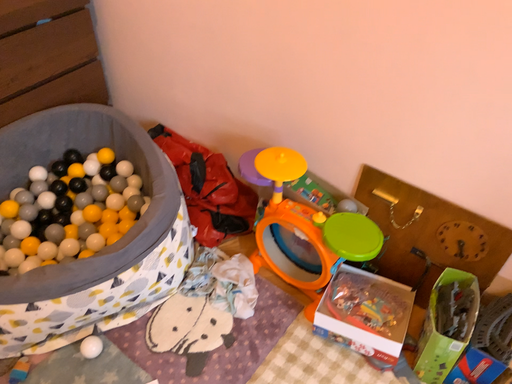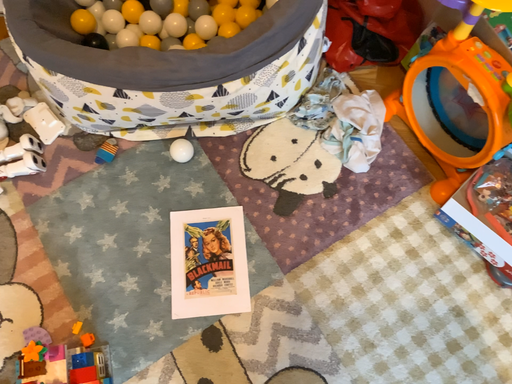
Question: Which way did the camera rotate in the video?

Choices:
 (A) rotated left
 (B) rotated right

Answer: (A)